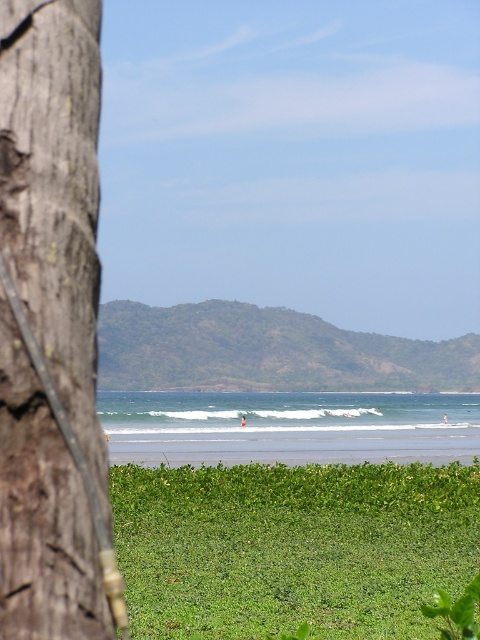
Between green leafy grass at lower center and green leafy tree at center, which one is positioned higher?

green leafy tree at center is above.

Does green leafy grass at lower center appear under green leafy tree at center?

Indeed, green leafy grass at lower center is positioned under green leafy tree at center.

Does point (464, 493) come closer to viewer compared to point (163, 312)?

Yes, point (464, 493) is in front of point (163, 312).

At what (x,y) coordinates should I click in order to perform the action: click on green leafy grass at lower center. Please return your answer as a coordinate pair (x, y). Looking at the image, I should click on (292, 547).

Looking at this image, who is more distant from viewer, (38, 202) or (466, 372)?

Point (466, 372)

Between point (20, 557) and point (268, 381), which one is positioned behind?

The point (268, 381) is behind.

Identify the location of brown rough tree trunk at left. The height and width of the screenshot is (640, 480). (55, 196).

At what (x,y) coordinates should I click in order to perform the action: click on brown rough tree trunk at left. Please return your answer as a coordinate pair (x, y). Image resolution: width=480 pixels, height=640 pixels. Looking at the image, I should click on (55, 196).

Is brown rough tree trunk at left shorter than green leafy grass at lower center?

Incorrect, brown rough tree trunk at left's height does not fall short of green leafy grass at lower center's.

Is point (10, 227) farther from camera compared to point (155, 625)?

No.

Where is `brown rough tree trunk at left`? The height and width of the screenshot is (640, 480). brown rough tree trunk at left is located at coordinates (55, 196).